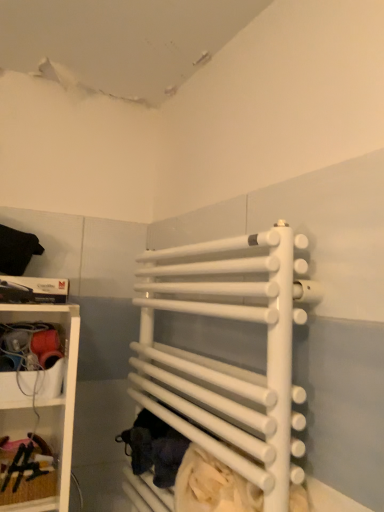
Question: Can you confirm if white matte towel rack at center is positioned to the left of wooden at left?

Choices:
 (A) yes
 (B) no

Answer: (B)

Question: Is white matte towel rack at center thinner than wooden at left?

Choices:
 (A) no
 (B) yes

Answer: (A)

Question: From a real-world perspective, is white matte towel rack at center over wooden at left?

Choices:
 (A) yes
 (B) no

Answer: (A)

Question: From the image's perspective, is white matte towel rack at center beneath wooden at left?

Choices:
 (A) no
 (B) yes

Answer: (A)

Question: Is white matte towel rack at center in contact with wooden at left?

Choices:
 (A) no
 (B) yes

Answer: (A)

Question: Does white matte towel rack at center have a smaller size compared to wooden at left?

Choices:
 (A) no
 (B) yes

Answer: (A)

Question: Considering the relative positions of wooden at left and white matte towel rack at center in the image provided, is wooden at left in front of white matte towel rack at center?

Choices:
 (A) yes
 (B) no

Answer: (B)

Question: From the image's perspective, is wooden at left under white matte towel rack at center?

Choices:
 (A) yes
 (B) no

Answer: (A)

Question: Is wooden at left oriented away from white matte towel rack at center?

Choices:
 (A) yes
 (B) no

Answer: (B)

Question: Considering the relative sizes of wooden at left and white matte towel rack at center in the image provided, is wooden at left wider than white matte towel rack at center?

Choices:
 (A) yes
 (B) no

Answer: (B)

Question: Is wooden at left bigger than white matte towel rack at center?

Choices:
 (A) no
 (B) yes

Answer: (A)

Question: Is wooden at left at the right side of white matte towel rack at center?

Choices:
 (A) no
 (B) yes

Answer: (A)

Question: In terms of width, does white matte towel rack at center look wider or thinner when compared to wooden at left?

Choices:
 (A) wide
 (B) thin

Answer: (A)